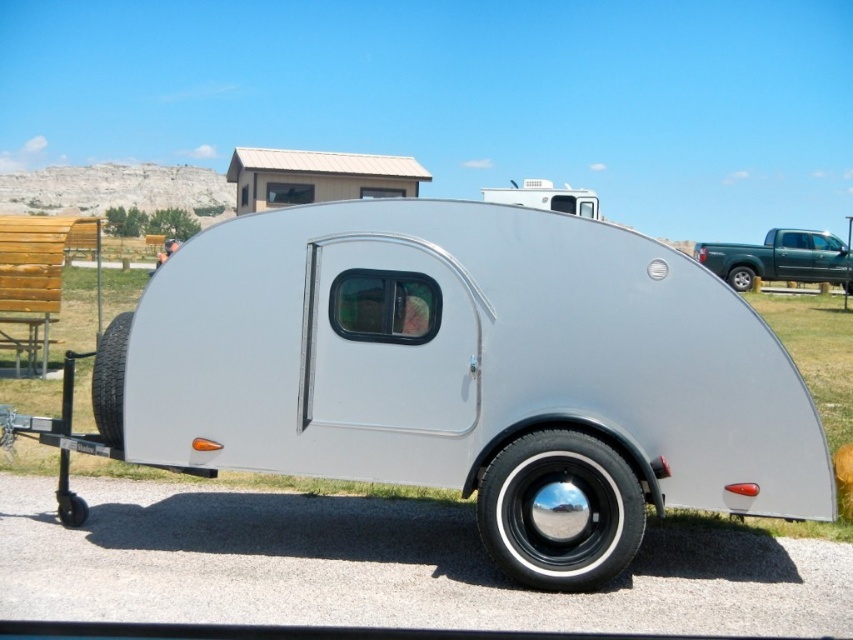
You are standing in front of the vintage teardrop trailer and notice a specific point at coordinates point (x=560, y=512). Based on the scene description, what object does this point most likely represent?

The point (x=560, y=512) corresponds to the shiny chrome wheel at lower center.

You are a mechanic checking the trailer for maintenance. You need to replace the shiny chrome wheel at lower center and the black rubber tire at lower left. Which part requires a larger replacement part?

The shiny chrome wheel at lower center requires a larger replacement part since it has a larger size compared to the black rubber tire at lower left according to the description.

You are standing in front of the vintage teardrop trailer. There is a point marked at coordinates (471, 374). Based on the scene description, what object is located at that point?

The point at coordinates (471, 374) indicates the silver metallic teardrop trailer at center.